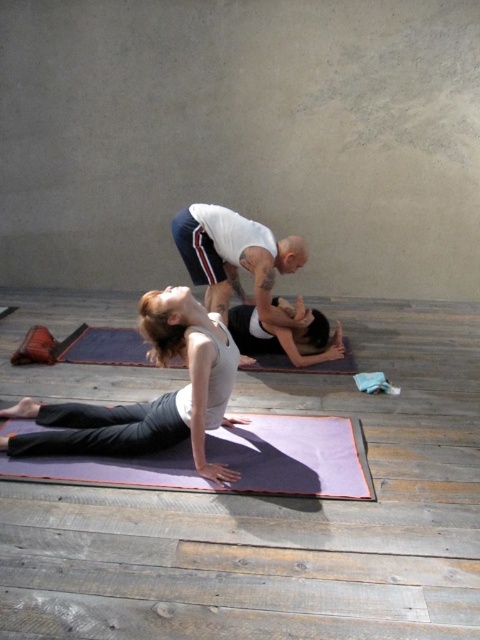
Question: Is white tank top at center to the right of purple yoga mat at center from the viewer's perspective?

Choices:
 (A) no
 (B) yes

Answer: (B)

Question: Is matte white tank top at center bigger than wooden plank at lower center?

Choices:
 (A) yes
 (B) no

Answer: (A)

Question: Estimate the real-world distances between objects in this image. Which object is closer to the wooden plank at lower center?

Choices:
 (A) purple yoga mat at center
 (B) purple rubber yoga mat at lower center

Answer: (B)

Question: Based on their relative distances, which object is nearer to the matte white tank top at center?

Choices:
 (A) wooden plank at lower center
 (B) purple rubber yoga mat at lower center

Answer: (B)

Question: Does matte white tank top at center appear under purple rubber yoga mat at lower center?

Choices:
 (A) no
 (B) yes

Answer: (A)

Question: Which point appears farthest from the camera in this image?

Choices:
 (A) (350, 420)
 (B) (135, 342)
 (C) (141, 580)
 (D) (179, 237)

Answer: (B)